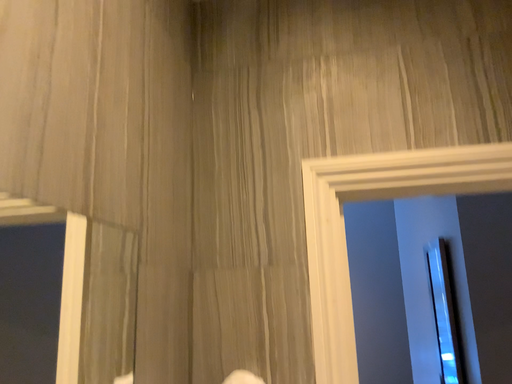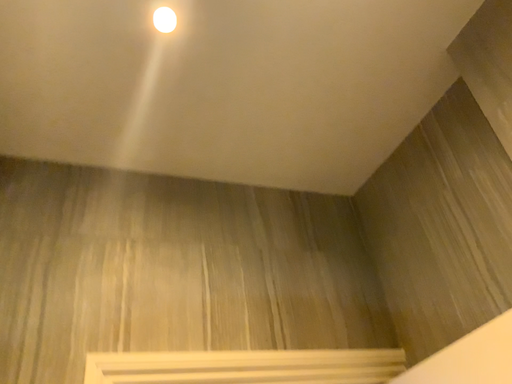
Question: Which way did the camera rotate in the video?

Choices:
 (A) rotated downward
 (B) rotated upward

Answer: (B)